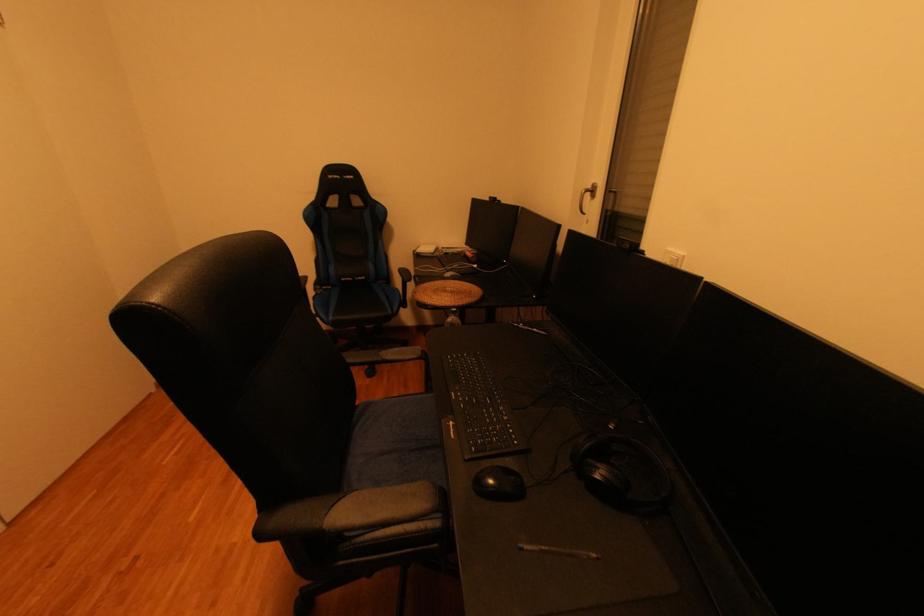
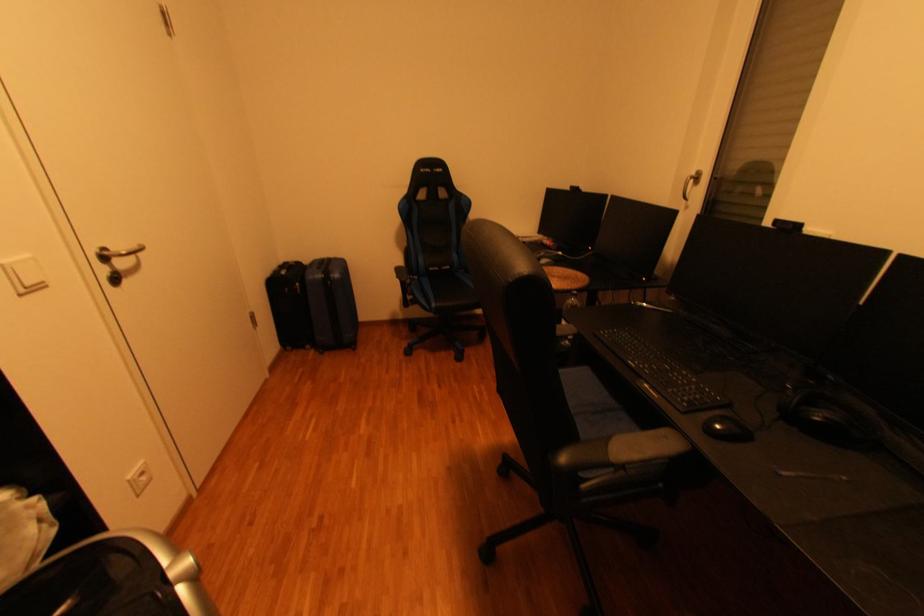
Question: How did the camera likely rotate?

Choices:
 (A) Left
 (B) Right
 (C) Up
 (D) Down

Answer: (D)